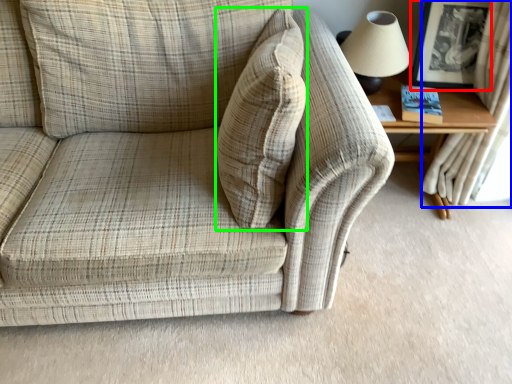
Question: Based on their relative distances, which object is farther from picture frame (highlighted by a red box)? Choose from curtain (highlighted by a blue box) and throw pillow (highlighted by a green box).

Choices:
 (A) curtain
 (B) throw pillow

Answer: (B)